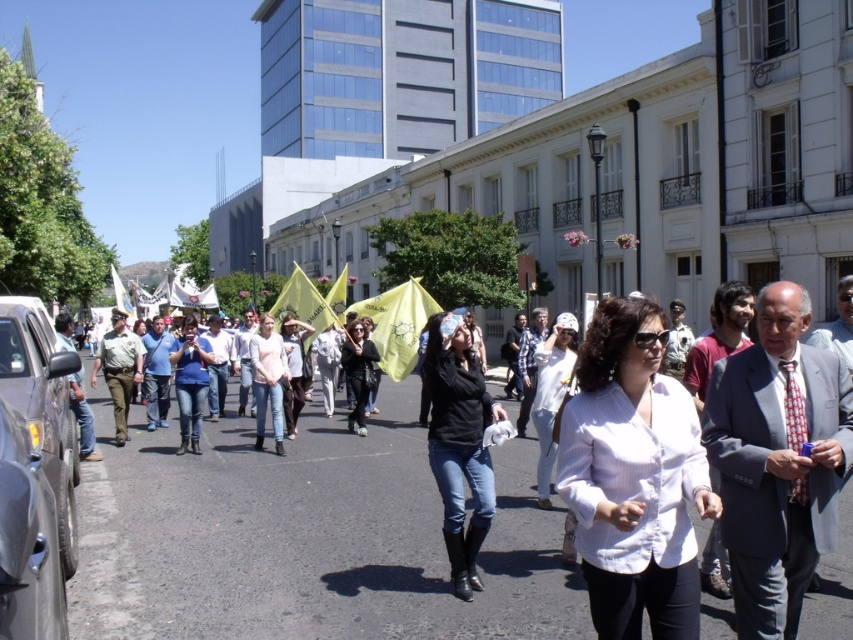
Is white textured blouse at center shorter than black matte jacket at center?

Yes, white textured blouse at center is shorter than black matte jacket at center.

Consider the image. Which is below, white textured blouse at center or black matte jacket at center?

Positioned lower is black matte jacket at center.

At what (x,y) coordinates should I click in order to perform the action: click on white textured blouse at center. Please return your answer as a coordinate pair (x, y). The height and width of the screenshot is (640, 853). Looking at the image, I should click on (633, 476).

Based on the photo, measure the distance between white shirt at center and camera.

The distance of white shirt at center from camera is 4.47 meters.

Can you confirm if white shirt at center is positioned below matte blue shirt at center?

Yes, white shirt at center is below matte blue shirt at center.

Locate an element on the screen. The image size is (853, 640). white shirt at center is located at coordinates (306, 538).

Identify the location of white shirt at center. This screenshot has width=853, height=640. (306, 538).

Between white shirt at center and gray pinstripe suit at center, which one appears on the right side from the viewer's perspective?

From the viewer's perspective, gray pinstripe suit at center appears more on the right side.

The height and width of the screenshot is (640, 853). I want to click on white shirt at center, so click(306, 538).